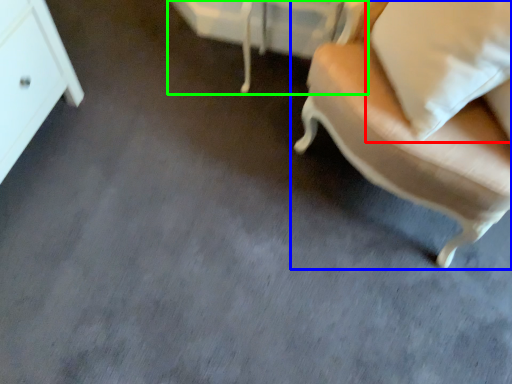
Question: Which object is positioned closest to pillow (highlighted by a red box)? Select from chair (highlighted by a blue box) and vanity (highlighted by a green box).

Choices:
 (A) chair
 (B) vanity

Answer: (A)